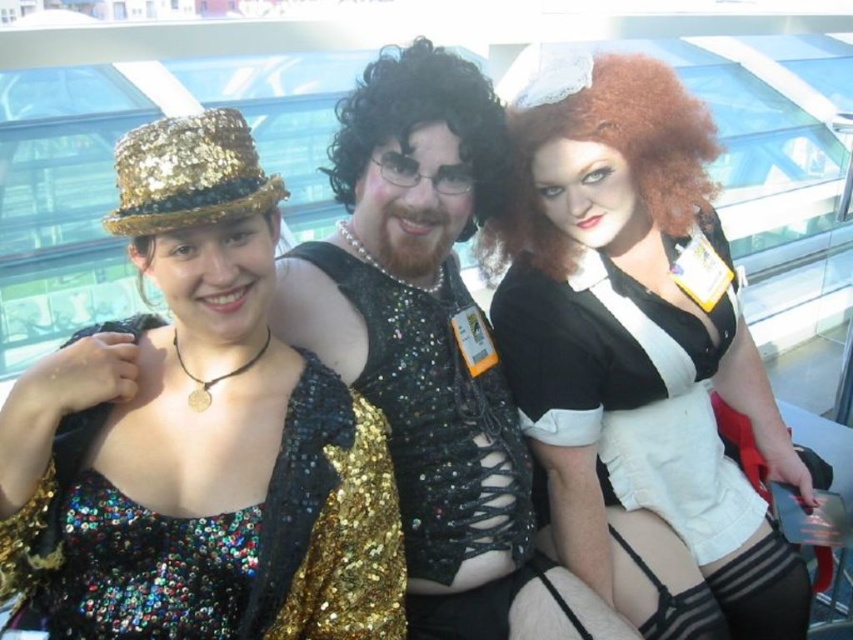
Question: Does sequined gold dress at center have a smaller size compared to curly brown wig at center?

Choices:
 (A) yes
 (B) no

Answer: (B)

Question: Which object is positioned farthest from the sequined fabric vest at center?

Choices:
 (A) white matte dress at center
 (B) curly brown wig at center

Answer: (B)

Question: Among these objects, which one is nearest to the camera?

Choices:
 (A) black curly wig at center
 (B) white matte dress at center
 (C) curly brown wig at center
 (D) sequined fabric vest at center

Answer: (D)

Question: Can you confirm if sequined fabric vest at center is wider than black curly wig at center?

Choices:
 (A) yes
 (B) no

Answer: (A)

Question: Which of the following is the closest to the observer?

Choices:
 (A) sequined fabric vest at center
 (B) black curly wig at center
 (C) white matte dress at center
 (D) curly brown wig at center

Answer: (A)

Question: In this image, where is sequined fabric vest at center located relative to black curly wig at center?

Choices:
 (A) above
 (B) below

Answer: (B)